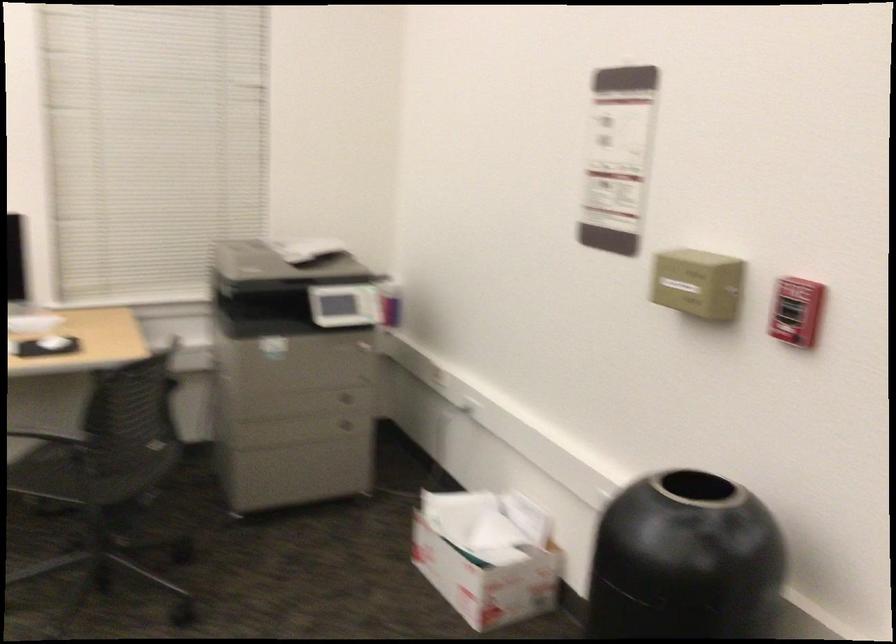
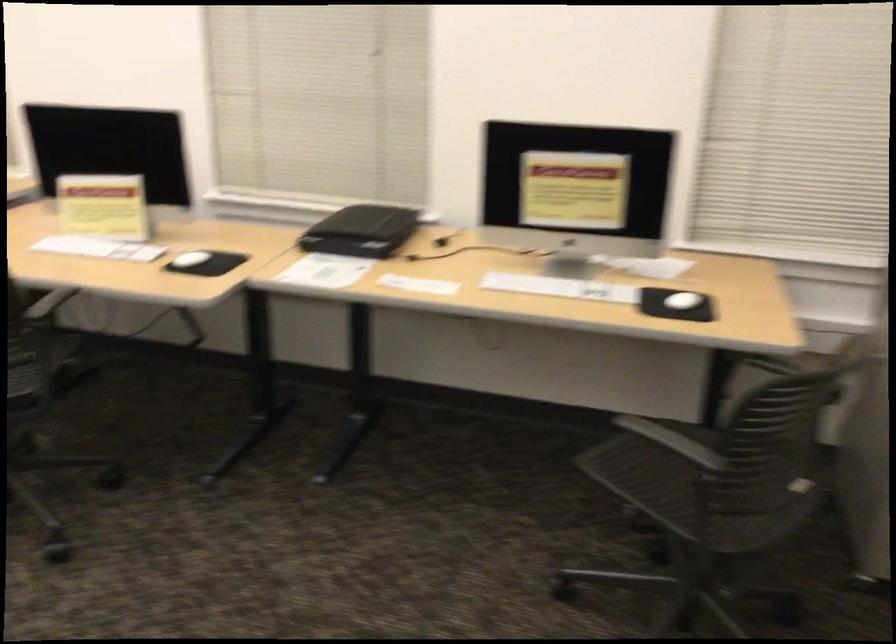
Question: The camera is either moving clockwise (left) or counter-clockwise (right) around the object. The first image is from the beginning of the video and the second image is from the end. Is the camera moving left or right when shooting the video?

Choices:
 (A) Left
 (B) Right

Answer: (B)